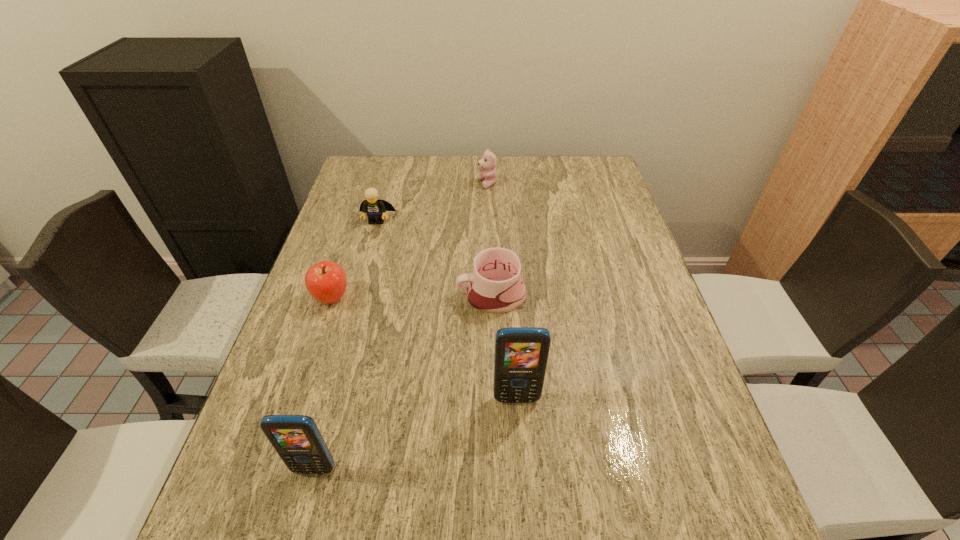
This screenshot has height=540, width=960. Find the location of `free spot between the apple and the fifth shortest object`. free spot between the apple and the fifth shortest object is located at coordinates (324, 383).

In order to click on free spot between the nearest object and the tallest object in this screenshot , I will do `click(416, 434)`.

Identify the location of blank region between the second farthest object and the apple. The image size is (960, 540). (354, 259).

The image size is (960, 540). What are the coordinates of `empty space between the fifth shortest object and the teddy bear` in the screenshot? It's located at (401, 327).

The image size is (960, 540). In order to click on free space between the mug and the teddy bear in this screenshot , I will do `click(490, 239)`.

Where is `empty location between the Lego and the right cellular telephone`? empty location between the Lego and the right cellular telephone is located at coordinates (446, 309).

This screenshot has height=540, width=960. What are the coordinates of `vacant space in between the apple and the Lego` in the screenshot? It's located at (354, 259).

The height and width of the screenshot is (540, 960). I want to click on unoccupied position between the second tallest object and the farthest object, so click(401, 327).

Find the location of a particular element. The height and width of the screenshot is (540, 960). unoccupied position between the Lego and the apple is located at coordinates pos(354,259).

Choose which object is the third nearest neighbor to the teddy bear. Please provide its 2D coordinates. Your answer should be formatted as a tuple, i.e. [(x, y)], where the tuple contains the x and y coordinates of a point satisfying the conditions above.

[(326, 281)]